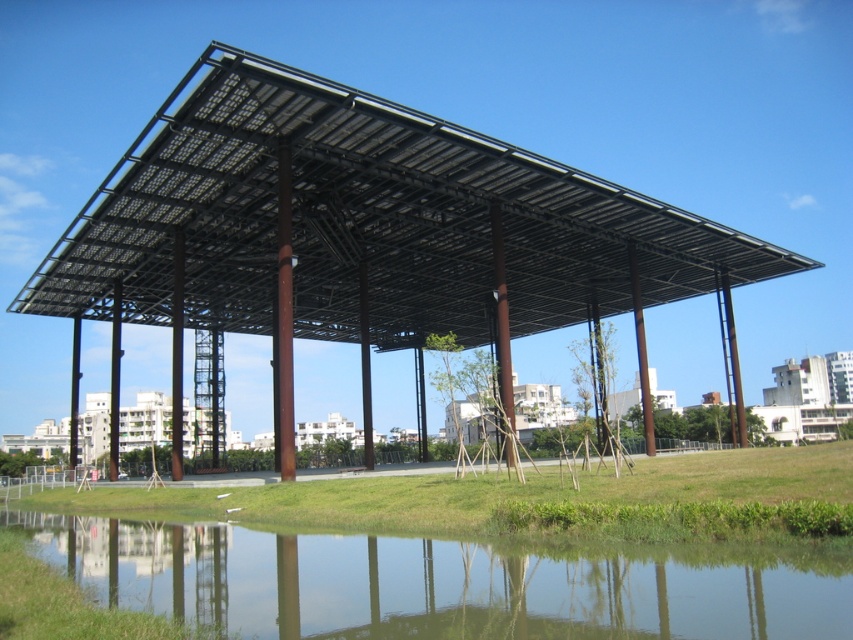
Does black metal roof at center appear over clear water at lower center?

Yes.

Between point (152, 172) and point (432, 630), which one is positioned in front?

Positioned in front is point (432, 630).

Identify the location of black metal roof at center. This screenshot has width=853, height=640. (366, 221).